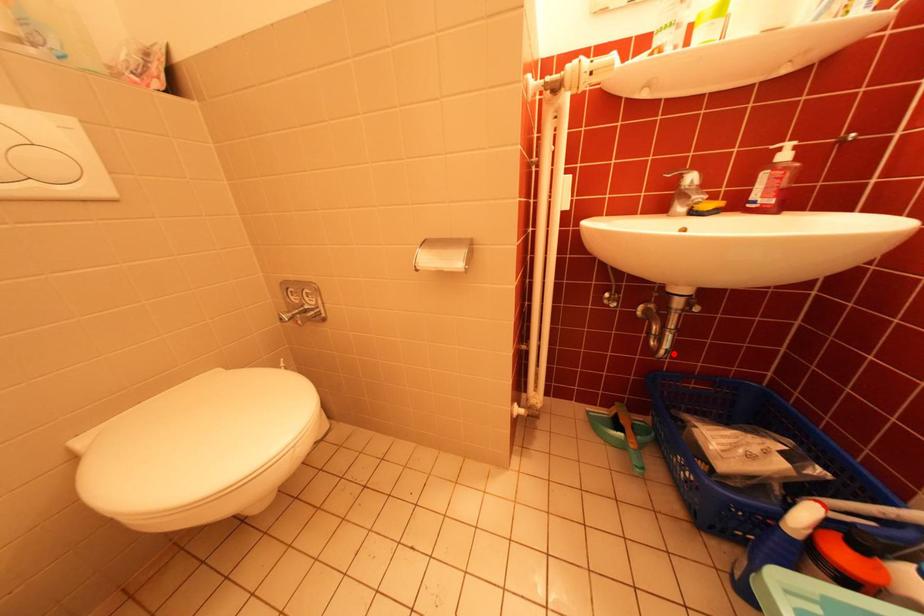
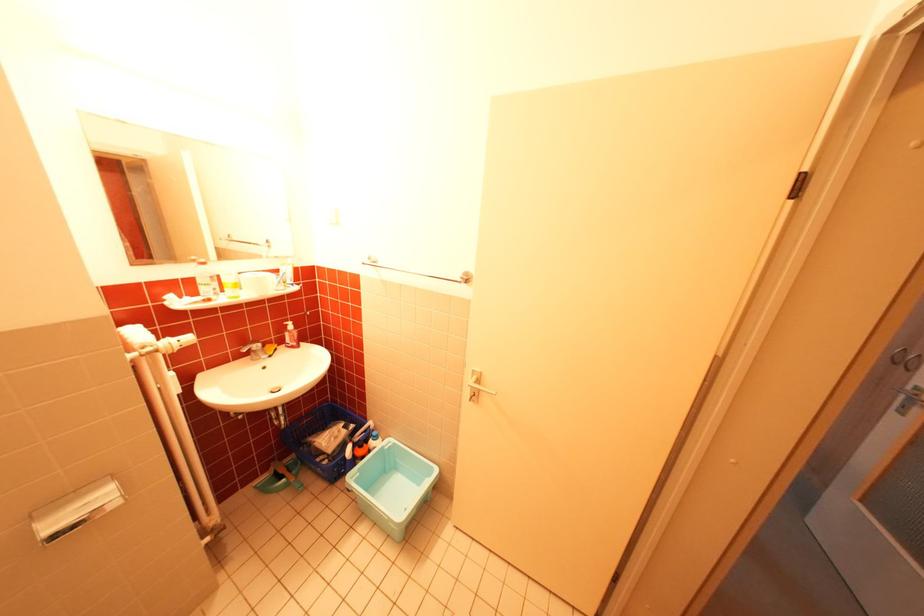
Find the pixel in the second image that matches the highlighted location in the first image.

(295, 428)